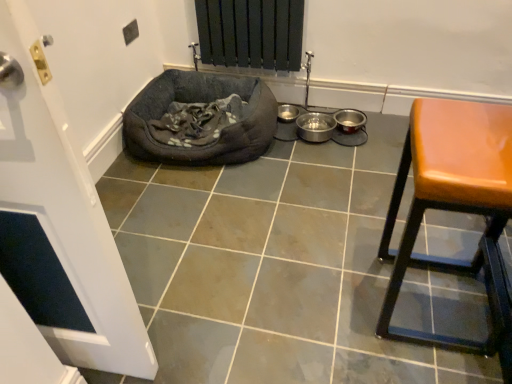
Question: From a real-world perspective, is dark gray fabric dog bed at lower left physically above leatherette stool at right?

Choices:
 (A) no
 (B) yes

Answer: (A)

Question: Can we say dark gray fabric dog bed at lower left lies outside leatherette stool at right?

Choices:
 (A) no
 (B) yes

Answer: (B)

Question: Does dark gray fabric dog bed at lower left contain leatherette stool at right?

Choices:
 (A) yes
 (B) no

Answer: (B)

Question: Does dark gray fabric dog bed at lower left have a larger size compared to leatherette stool at right?

Choices:
 (A) no
 (B) yes

Answer: (B)

Question: Is dark gray fabric dog bed at lower left further to the viewer compared to leatherette stool at right?

Choices:
 (A) no
 (B) yes

Answer: (B)

Question: Are dark gray fabric dog bed at lower left and leatherette stool at right far apart?

Choices:
 (A) no
 (B) yes

Answer: (A)

Question: Is dark gray fabric dog bed at lower left surrounded by leatherette stool at right?

Choices:
 (A) yes
 (B) no

Answer: (B)

Question: Considering the relative sizes of leatherette stool at right and dark gray fabric dog bed at lower left in the image provided, is leatherette stool at right wider than dark gray fabric dog bed at lower left?

Choices:
 (A) no
 (B) yes

Answer: (A)

Question: Does leatherette stool at right touch dark gray fabric dog bed at lower left?

Choices:
 (A) yes
 (B) no

Answer: (B)

Question: From the image's perspective, is leatherette stool at right over dark gray fabric dog bed at lower left?

Choices:
 (A) yes
 (B) no

Answer: (B)

Question: From the image's perspective, is leatherette stool at right located beneath dark gray fabric dog bed at lower left?

Choices:
 (A) no
 (B) yes

Answer: (B)

Question: Does leatherette stool at right have a lesser width compared to dark gray fabric dog bed at lower left?

Choices:
 (A) yes
 (B) no

Answer: (A)

Question: From the image's perspective, would you say matte gray tile at center is shown under dark gray fabric dog bed at lower left?

Choices:
 (A) yes
 (B) no

Answer: (A)